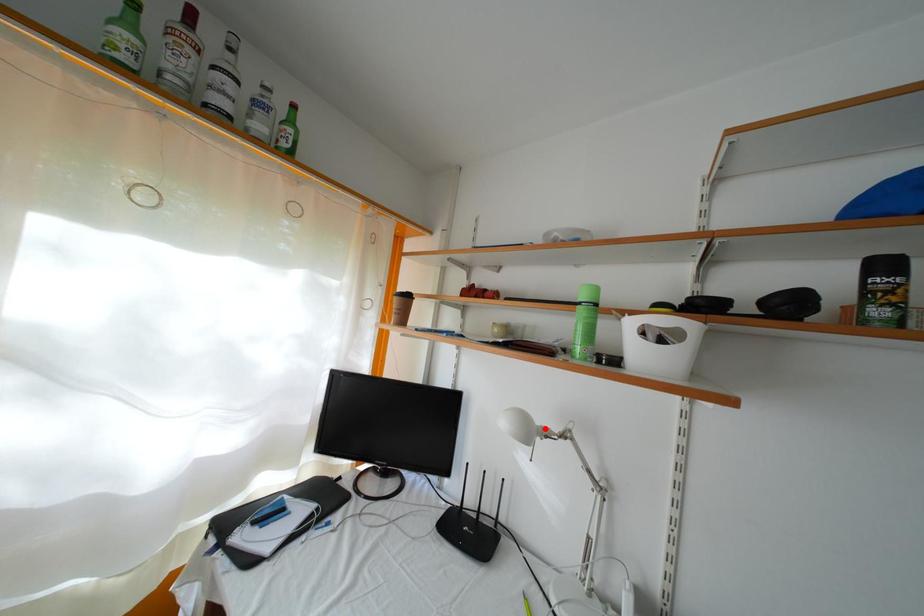
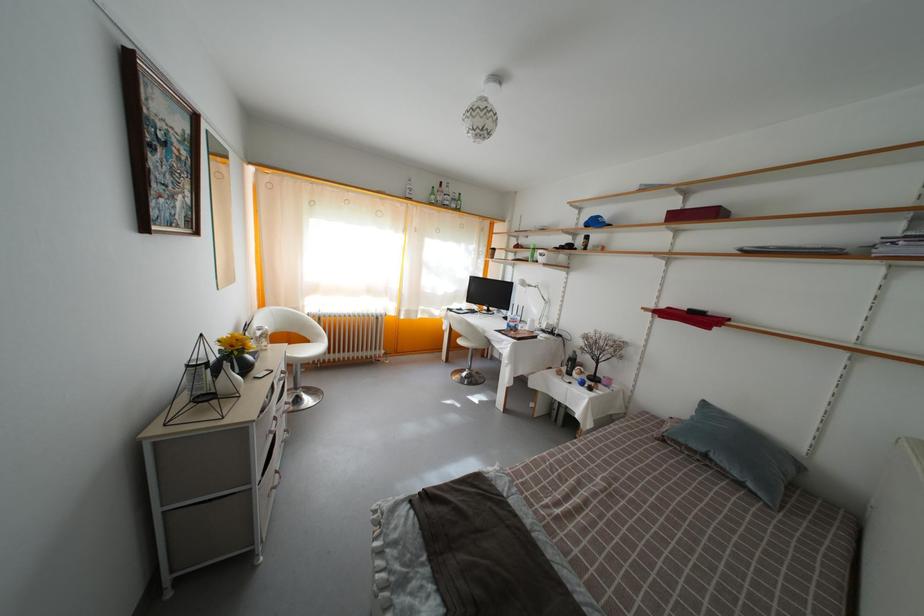
Question: I am providing you with two images of the same scene from different viewpoints. Given a red point in image1, look at the same physical point in image2. Is it:

Choices:
 (A) Closer to the viewpoint
 (B) Farther from the viewpoint

Answer: (A)